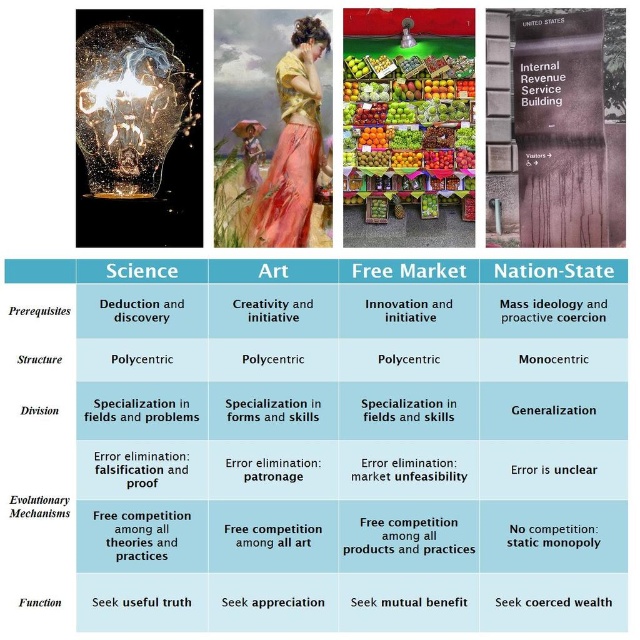
Question: Estimate the real-world distances between objects in this image. Which object is closer to the shiny plastic fruits at center?

Choices:
 (A) matte silver lamp at center
 (B) translucent glass bulb at upper left

Answer: (A)

Question: Is translucent glass bulb at upper left smaller than matte silver lamp at center?

Choices:
 (A) yes
 (B) no

Answer: (B)

Question: Which point appears closest to the camera in this image?

Choices:
 (A) (403, 28)
 (B) (164, 58)

Answer: (B)

Question: Can you confirm if shiny plastic fruits at center is positioned to the right of translucent glass bulb at upper left?

Choices:
 (A) yes
 (B) no

Answer: (A)

Question: Can you confirm if shiny plastic fruits at center is smaller than translucent glass bulb at upper left?

Choices:
 (A) no
 (B) yes

Answer: (B)

Question: Estimate the real-world distances between objects in this image. Which object is farther from the translucent glass bulb at upper left?

Choices:
 (A) shiny plastic fruits at center
 (B) matte silver lamp at center

Answer: (B)